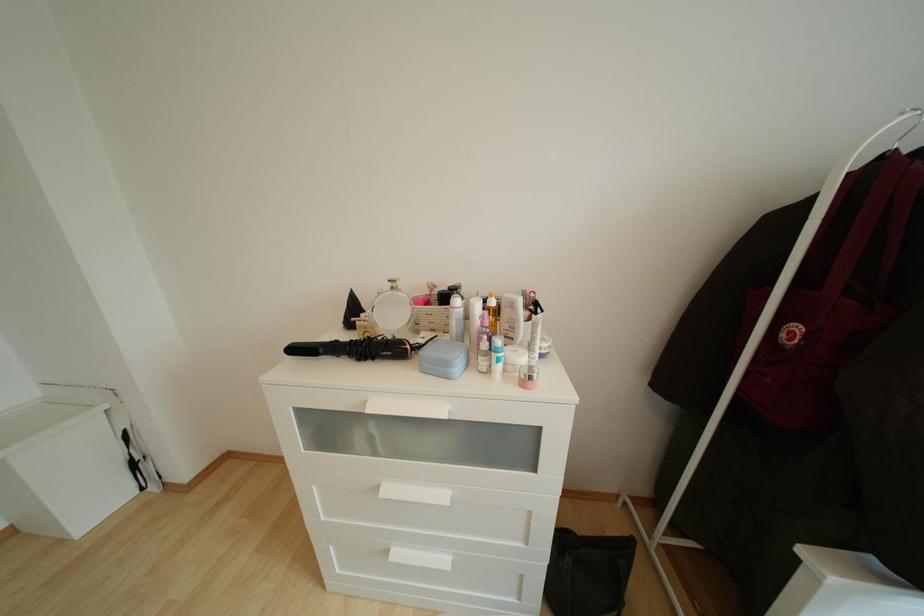
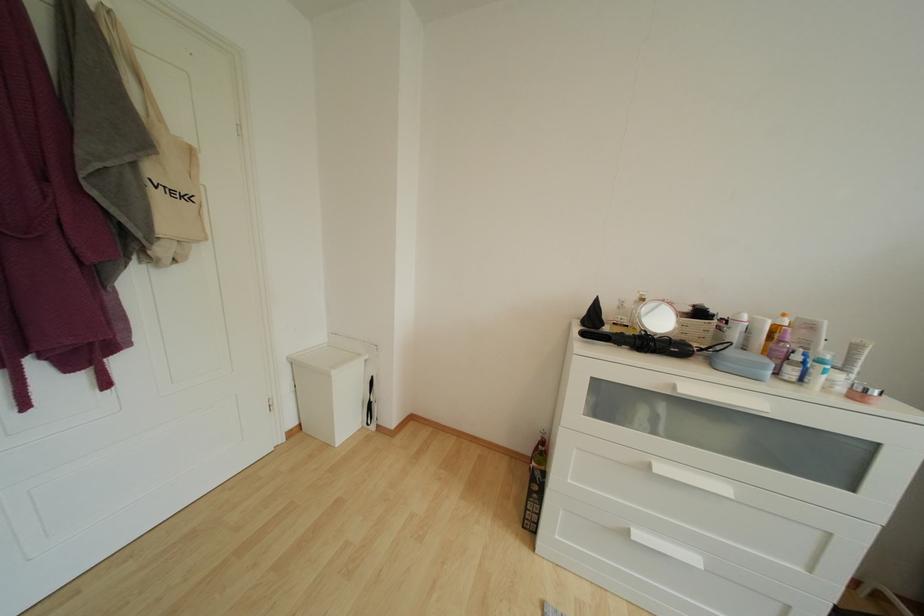
What movement of the cameraman would produce the second image?

The cameraman moved toward left, backward.